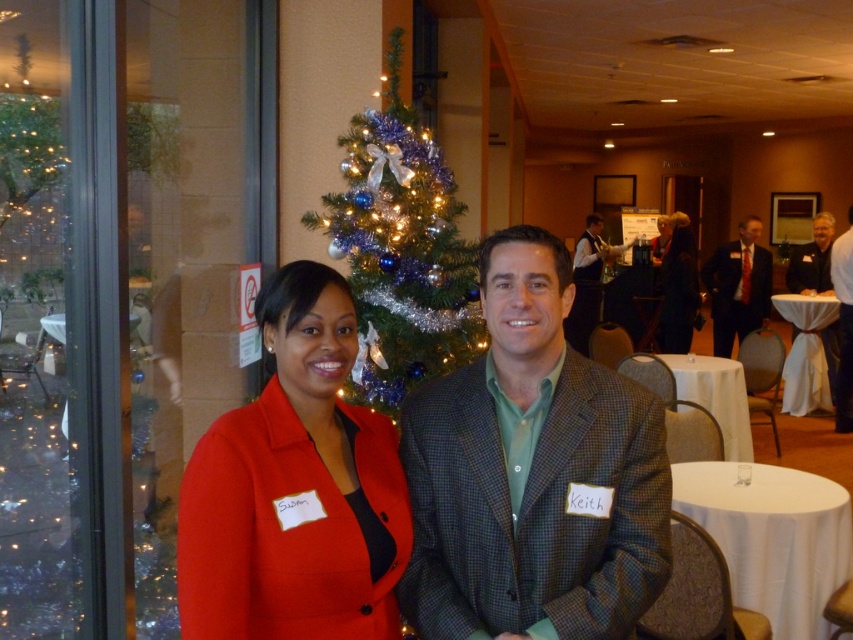
Is the position of shiny blue tinsel at center less distant than that of white cloth-covered table at right?

That is True.

This screenshot has width=853, height=640. I want to click on shiny blue tinsel at center, so click(401, 250).

Between point (434, 236) and point (833, 300), which one is positioned in front?

Point (434, 236) is in front.

The height and width of the screenshot is (640, 853). Identify the location of shiny blue tinsel at center. (401, 250).

How much distance is there between shiny blue tinsel at center and dark gray suit at right?

shiny blue tinsel at center is 6.24 meters from dark gray suit at right.

Between shiny blue tinsel at center and dark gray suit at right, which one appears on the left side from the viewer's perspective?

Positioned to the left is shiny blue tinsel at center.

Is point (401, 260) farther from viewer compared to point (825, 340)?

No.

Where is `shiny blue tinsel at center`? shiny blue tinsel at center is located at coordinates (401, 250).

This screenshot has width=853, height=640. What do you see at coordinates (805, 353) in the screenshot?
I see `white cloth-covered table at right` at bounding box center [805, 353].

Looking at this image, is white cloth-covered table at right shorter than light brown leather jacket at right?

Yes.

Is point (808, 381) closer to camera compared to point (851, 394)?

No, it is behind (851, 394).

Where is `white cloth-covered table at right`? The image size is (853, 640). white cloth-covered table at right is located at coordinates (805, 353).